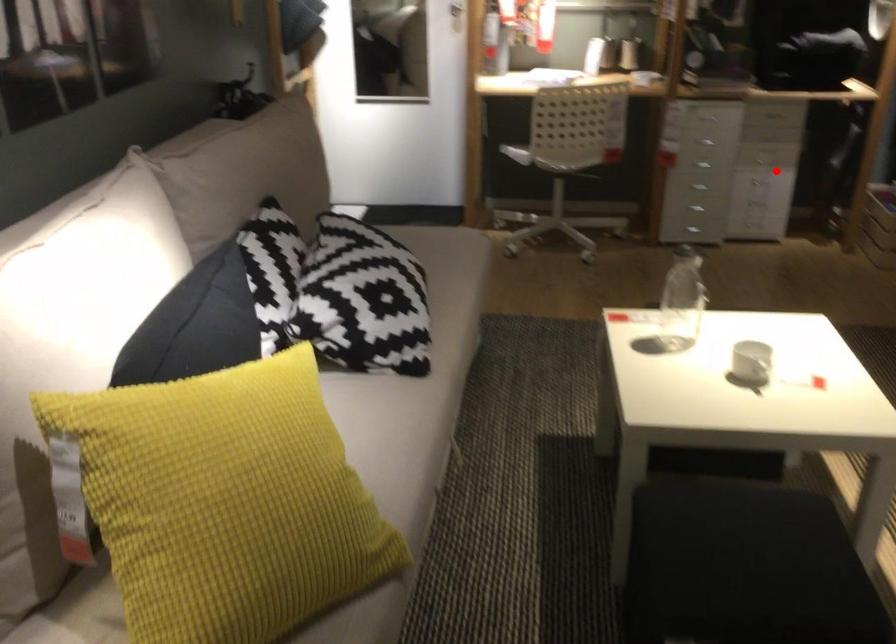
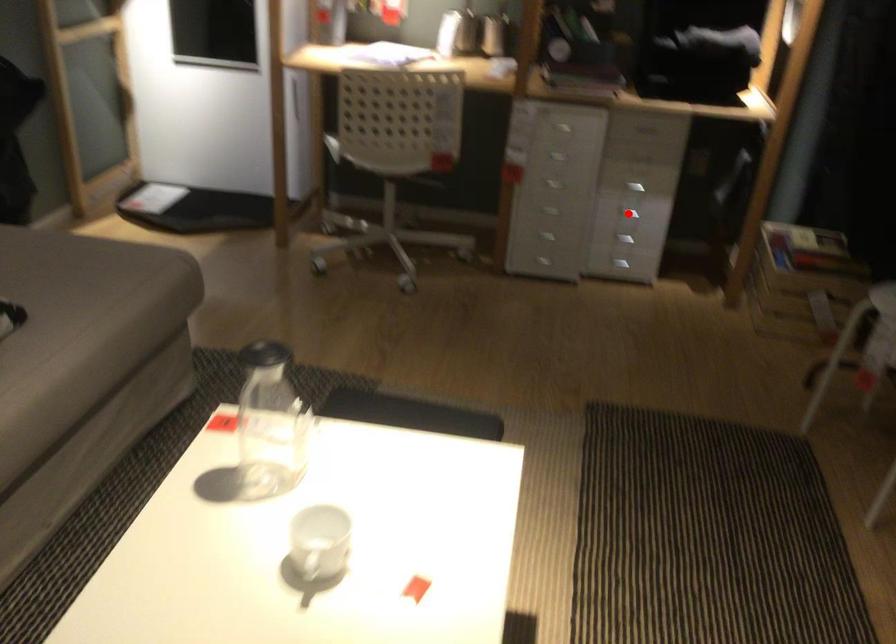
I am providing you with two images of the same scene from different viewpoints. A red point is marked on the first image and another point is marked on the second image. Do the highlighted points in image1 and image2 indicate the same real-world spot?

Yes